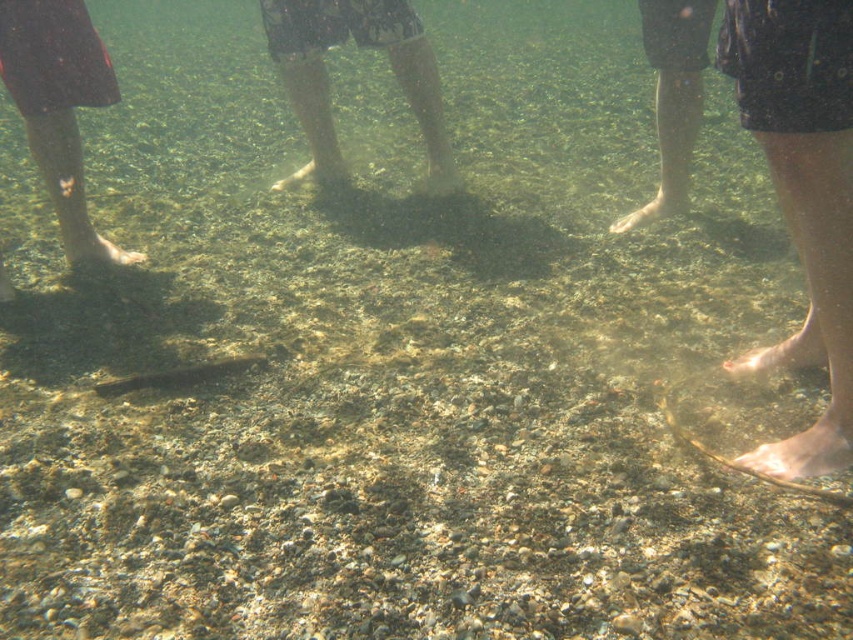
Question: Which point is farther to the camera?

Choices:
 (A) smooth skin leg at right
 (B) brown matte sand at center
 (C) pink matte foot at lower right

Answer: (B)

Question: Can you confirm if dark speckled shorts at right is bigger than brown matte sand at center?

Choices:
 (A) yes
 (B) no

Answer: (A)

Question: Does dark gray shorts at center appear on the left side of brown matte foot at lower right?

Choices:
 (A) yes
 (B) no

Answer: (A)

Question: Among these objects, which one is nearest to the camera?

Choices:
 (A) dark speckled shorts at right
 (B) smooth skin leg at right
 (C) brown matte foot at lower right
 (D) dark gray shorts at center

Answer: (B)

Question: Does smooth skin leg at right lie behind dark speckled shorts at right?

Choices:
 (A) yes
 (B) no

Answer: (B)

Question: Estimate the real-world distances between objects in this image. Which object is closer to the brown matte sand at center?

Choices:
 (A) matte skin foot at center
 (B) dark gray shorts at center
 (C) smooth skin leg at right

Answer: (B)